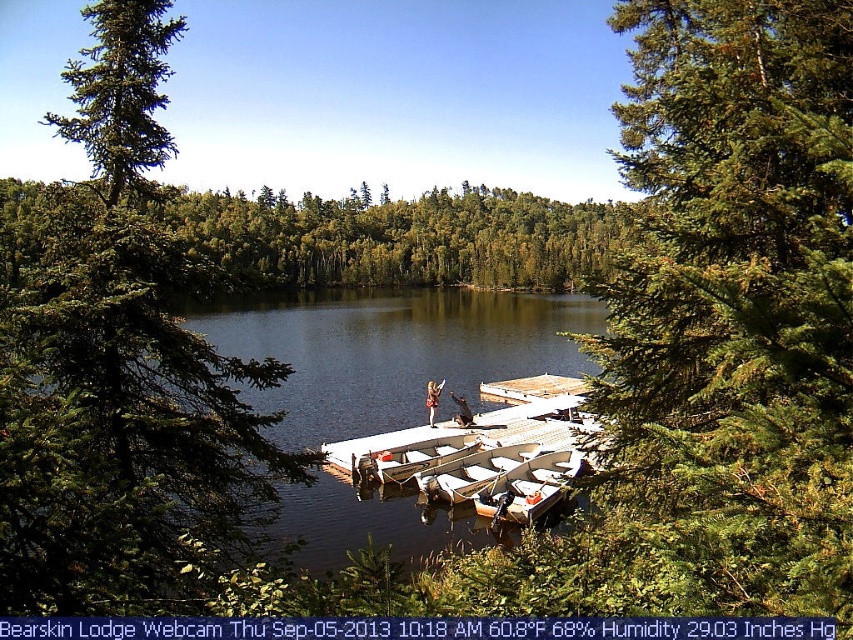
Who is positioned more to the right, light brown wooden paddle at center or light brown leather jacket at center?

From the viewer's perspective, light brown leather jacket at center appears more on the right side.

Does light brown wooden paddle at center have a lesser height compared to light brown leather jacket at center?

No.

Where is `light brown wooden paddle at center`? The image size is (853, 640). light brown wooden paddle at center is located at coordinates (432, 397).

What are the coordinates of `light brown wooden paddle at center` in the screenshot? It's located at (432, 397).

Measure the distance between point (686, 595) and camera.

Point (686, 595) is 4.64 meters away from camera.

Can you confirm if green needle-like leaves at upper right is positioned to the left of green evergreen tree at center?

No, green needle-like leaves at upper right is not to the left of green evergreen tree at center.

Identify the location of green needle-like leaves at upper right. The height and width of the screenshot is (640, 853). (730, 314).

Where is `green needle-like leaves at upper right`? This screenshot has width=853, height=640. green needle-like leaves at upper right is located at coordinates (730, 314).

Can you confirm if green leafy trees at upper center is taller than light brown wooden paddle at center?

Yes, green leafy trees at upper center is taller than light brown wooden paddle at center.

Identify the location of green leafy trees at upper center. (399, 237).